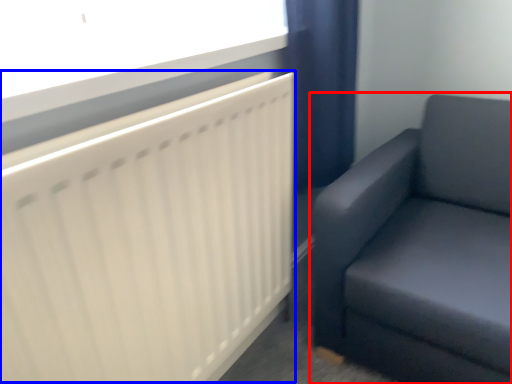
Question: Which point is closer to the camera, studio couch (highlighted by a red box) or radiator (highlighted by a blue box)?

Choices:
 (A) studio couch
 (B) radiator

Answer: (B)